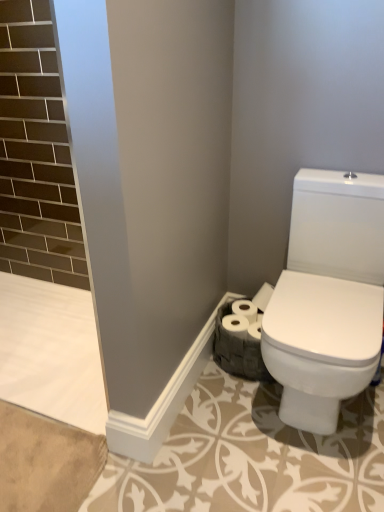
At what (x,y) coordinates should I click in order to perform the action: click on white matte toilet paper at lower right. Please return your answer as a coordinate pair (x, y). The image size is (384, 512). Looking at the image, I should click on click(243, 319).

This screenshot has width=384, height=512. Describe the element at coordinates (243, 319) in the screenshot. I see `white matte toilet paper at lower right` at that location.

In order to click on white matte toilet paper at lower right in this screenshot , I will do `click(243, 319)`.